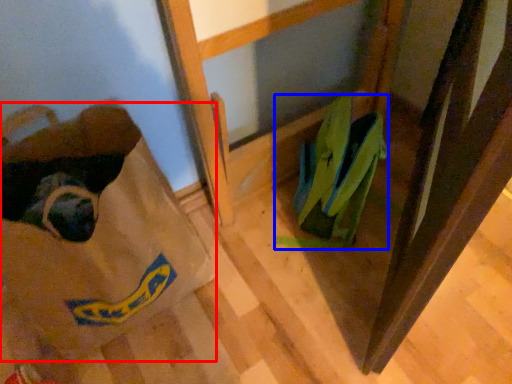
Question: Among these objects, which one is nearest to the camera, grocery bag (highlighted by a red box) or footwear (highlighted by a blue box)?

Choices:
 (A) grocery bag
 (B) footwear

Answer: (A)